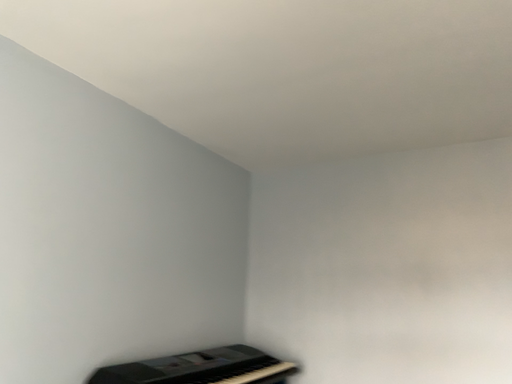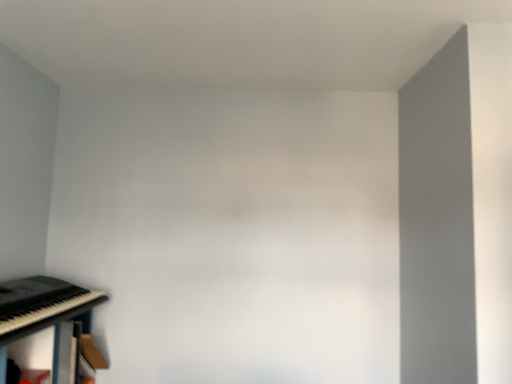
Question: Which way did the camera rotate in the video?

Choices:
 (A) rotated upward
 (B) rotated downward

Answer: (B)